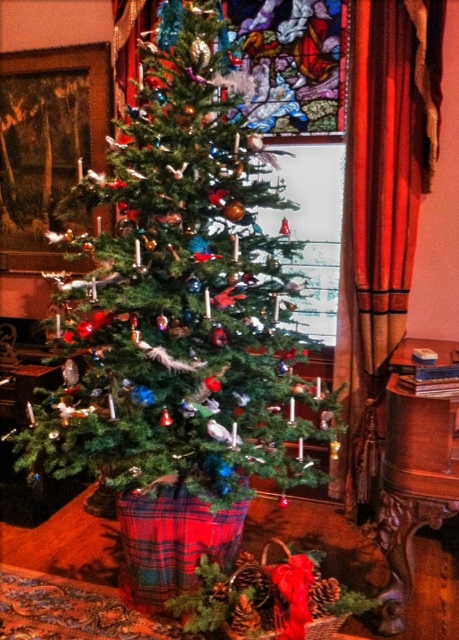
Question: Which point is farther to the camera?

Choices:
 (A) (208, 340)
 (B) (87, 108)

Answer: (B)

Question: Is green matte christmas tree at center above shiny green tree at center?

Choices:
 (A) yes
 (B) no

Answer: (B)

Question: Is the position of green matte christmas tree at center less distant than that of shiny green tree at center?

Choices:
 (A) no
 (B) yes

Answer: (B)

Question: Which object appears farthest from the camera in this image?

Choices:
 (A) shiny green tree at center
 (B) green matte christmas tree at center

Answer: (A)

Question: Which of the following is the closest to the observer?

Choices:
 (A) (95, 333)
 (B) (87, 96)

Answer: (A)

Question: Where is green matte christmas tree at center located in relation to shiny green tree at center in the image?

Choices:
 (A) left
 (B) right

Answer: (B)